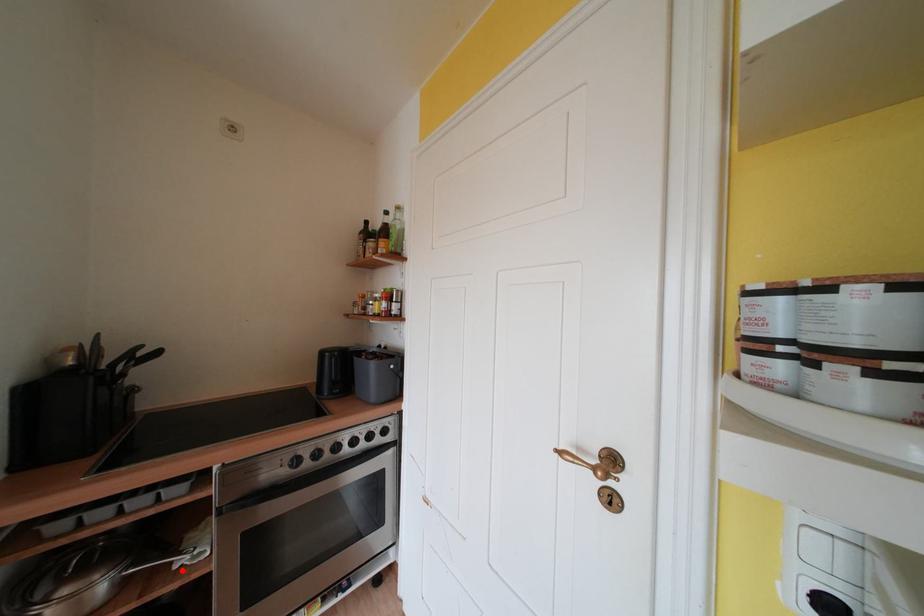
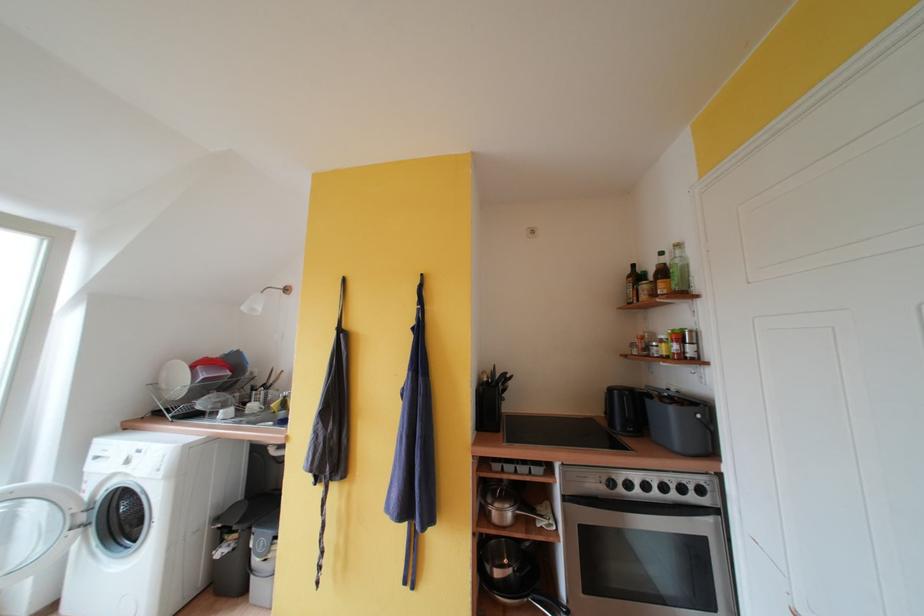
Question: I am providing you with two images of the same scene from different viewpoints. In image1, a red point is highlighted. Considering the same 3D point in image2, which of the following is correct?

Choices:
 (A) It is closer
 (B) It is farther

Answer: (B)